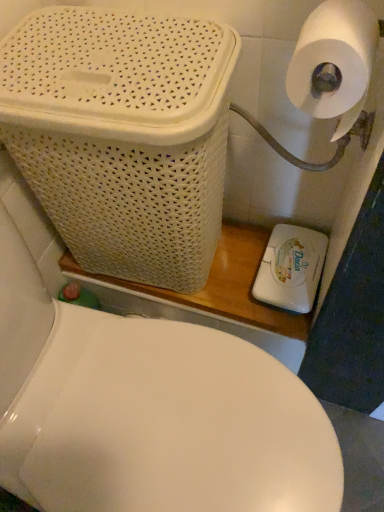
Question: Would you consider white matte toilet paper at upper right to be distant from white plastic soap dispenser at lower right?

Choices:
 (A) yes
 (B) no

Answer: (B)

Question: Can we say white matte toilet paper at upper right lies outside white plastic soap dispenser at lower right?

Choices:
 (A) no
 (B) yes

Answer: (B)

Question: Is white matte toilet paper at upper right positioned behind white plastic soap dispenser at lower right?

Choices:
 (A) no
 (B) yes

Answer: (A)

Question: Is white matte toilet paper at upper right touching white plastic soap dispenser at lower right?

Choices:
 (A) yes
 (B) no

Answer: (B)

Question: Does white matte toilet paper at upper right have a greater height compared to white plastic soap dispenser at lower right?

Choices:
 (A) no
 (B) yes

Answer: (B)

Question: From a real-world perspective, relative to white plastic soap dispenser at lower right, is white wicker basket at upper left vertically above or below?

Choices:
 (A) below
 (B) above

Answer: (B)

Question: Is point (172, 207) positioned closer to the camera than point (261, 295)?

Choices:
 (A) closer
 (B) farther

Answer: (A)

Question: From the image's perspective, is white wicker basket at upper left positioned above or below white plastic soap dispenser at lower right?

Choices:
 (A) above
 (B) below

Answer: (A)

Question: Is white wicker basket at upper left spatially inside white plastic soap dispenser at lower right, or outside of it?

Choices:
 (A) outside
 (B) inside

Answer: (A)

Question: From a real-world perspective, is white plastic soap dispenser at lower right physically located above or below white wicker basket at upper left?

Choices:
 (A) above
 (B) below

Answer: (B)

Question: Is white plastic soap dispenser at lower right bigger or smaller than white wicker basket at upper left?

Choices:
 (A) small
 (B) big

Answer: (A)

Question: Would you say white plastic soap dispenser at lower right is to the left or to the right of white wicker basket at upper left in the picture?

Choices:
 (A) right
 (B) left

Answer: (A)

Question: Considering the positions of white plastic soap dispenser at lower right and white wicker basket at upper left in the image, is white plastic soap dispenser at lower right wider or thinner than white wicker basket at upper left?

Choices:
 (A) thin
 (B) wide

Answer: (A)

Question: Considering the positions of white plastic soap dispenser at lower right and white matte toilet paper at upper right in the image, is white plastic soap dispenser at lower right wider or thinner than white matte toilet paper at upper right?

Choices:
 (A) thin
 (B) wide

Answer: (B)

Question: Is white plastic soap dispenser at lower right in front of or behind white matte toilet paper at upper right in the image?

Choices:
 (A) behind
 (B) front

Answer: (A)